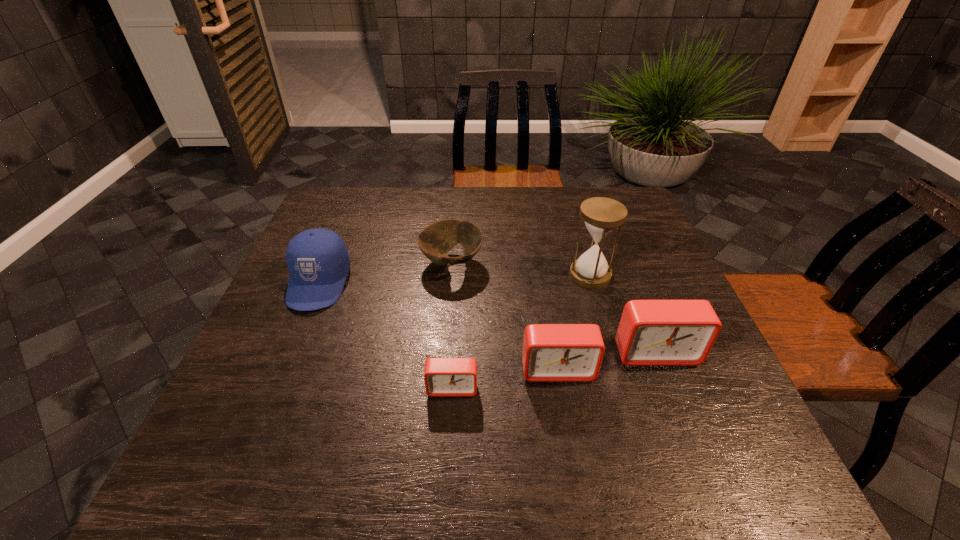
Please point a vacant point for placing a alarm clock on the left. Please provide its 2D coordinates. Your answer should be formatted as a tuple, i.e. [(x, y)], where the tuple contains the x and y coordinates of a point satisfying the conditions above.

[(338, 408)]